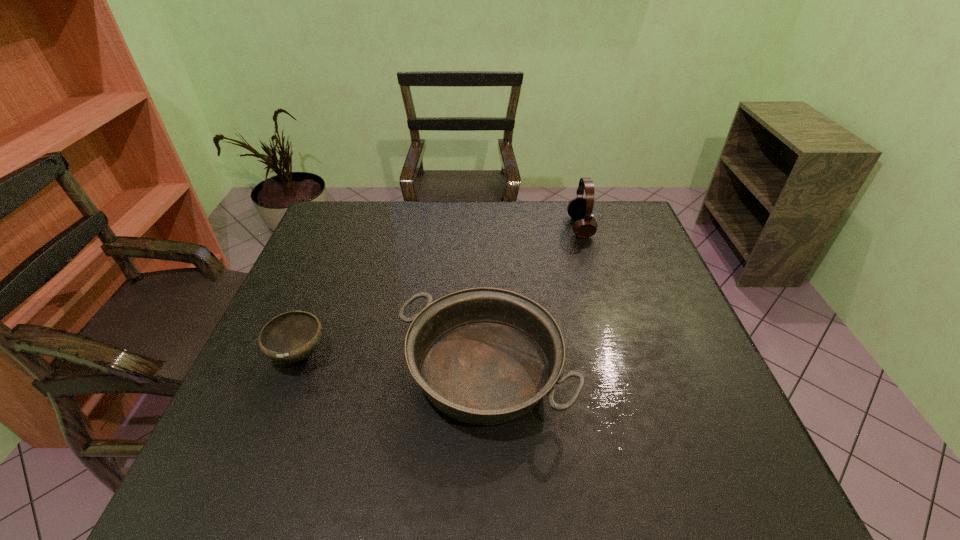
Point out which object is positioned as the second nearest to the farthest object. Please provide its 2D coordinates. Your answer should be formatted as a tuple, i.e. [(x, y)], where the tuple contains the x and y coordinates of a point satisfying the conditions above.

[(290, 337)]

You are a GUI agent. You are given a task and a screenshot of the screen. Output one action in this format:
    pyautogui.click(x=<x>, y=<y>)
    Task: Click on the closest object to the leftmost object
    The height and width of the screenshot is (540, 960).
    Given the screenshot: What is the action you would take?
    pyautogui.click(x=485, y=356)

Image resolution: width=960 pixels, height=540 pixels. In order to click on vacant area that satisfies the following two spatial constraints: 1. on the front side of the leftmost object; 2. on the right side of the second object from right to left in this screenshot , I will do `click(291, 373)`.

The height and width of the screenshot is (540, 960). I want to click on vacant space that satisfies the following two spatial constraints: 1. on the front side of the bowl; 2. on the right side of the pan, so click(x=291, y=373).

The height and width of the screenshot is (540, 960). In order to click on free space that satisfies the following two spatial constraints: 1. on the ear pads of the rightmost object; 2. on the front side of the pan in this screenshot , I will do `click(624, 373)`.